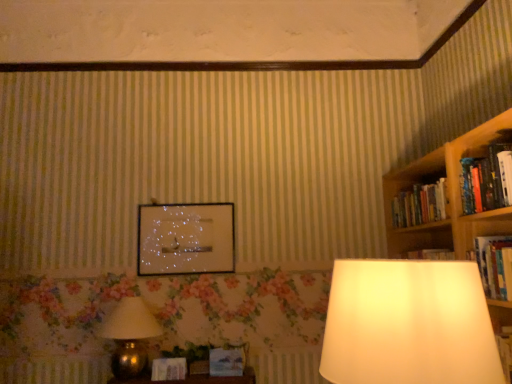
Question: Is matte blue paperback book at center, acting as the second paperback book starting from the left, in front of glossy glass picture frame at center?

Choices:
 (A) no
 (B) yes

Answer: (B)

Question: Is matte blue paperback book at center, acting as the second paperback book starting from the left, at the right side of glossy glass picture frame at center?

Choices:
 (A) yes
 (B) no

Answer: (A)

Question: Is matte blue paperback book at center, the first paperback book positioned from the right, bigger than glossy glass picture frame at center?

Choices:
 (A) no
 (B) yes

Answer: (A)

Question: Is matte blue paperback book at center, acting as the second paperback book starting from the left, looking in the opposite direction of glossy glass picture frame at center?

Choices:
 (A) no
 (B) yes

Answer: (A)

Question: Can you confirm if matte blue paperback book at center, the first paperback book positioned from the right, is shorter than glossy glass picture frame at center?

Choices:
 (A) no
 (B) yes

Answer: (B)

Question: Is matte blue paperback book at center, the first paperback book positioned from the right, located outside glossy glass picture frame at center?

Choices:
 (A) yes
 (B) no

Answer: (A)

Question: Does matte blue paperback book at center, acting as the second paperback book starting from the left, appear on the right side of hardcover book at right, arranged as the 2th book when viewed from the top?

Choices:
 (A) no
 (B) yes

Answer: (A)

Question: Can you confirm if matte blue paperback book at center, the first paperback book positioned from the right, is bigger than hardcover book at right, arranged as the 2th book when viewed from the top?

Choices:
 (A) no
 (B) yes

Answer: (A)

Question: Could you tell me if matte blue paperback book at center, the first paperback book positioned from the right, is facing hardcover book at right, the 1th book positioned from the bottom?

Choices:
 (A) no
 (B) yes

Answer: (A)

Question: Is matte blue paperback book at center, acting as the second paperback book starting from the left, taller than hardcover book at right, arranged as the 2th book when viewed from the top?

Choices:
 (A) yes
 (B) no

Answer: (B)

Question: From a real-world perspective, does matte blue paperback book at center, acting as the second paperback book starting from the left, sit lower than hardcover book at right, the 1th book positioned from the bottom?

Choices:
 (A) no
 (B) yes

Answer: (B)

Question: Does matte blue paperback book at center, the first paperback book positioned from the right, lie in front of hardcover book at right, arranged as the 2th book when viewed from the top?

Choices:
 (A) no
 (B) yes

Answer: (A)

Question: From the image's perspective, is glossy glass picture frame at center located beneath gold metallic lamp at lower left?

Choices:
 (A) no
 (B) yes

Answer: (A)